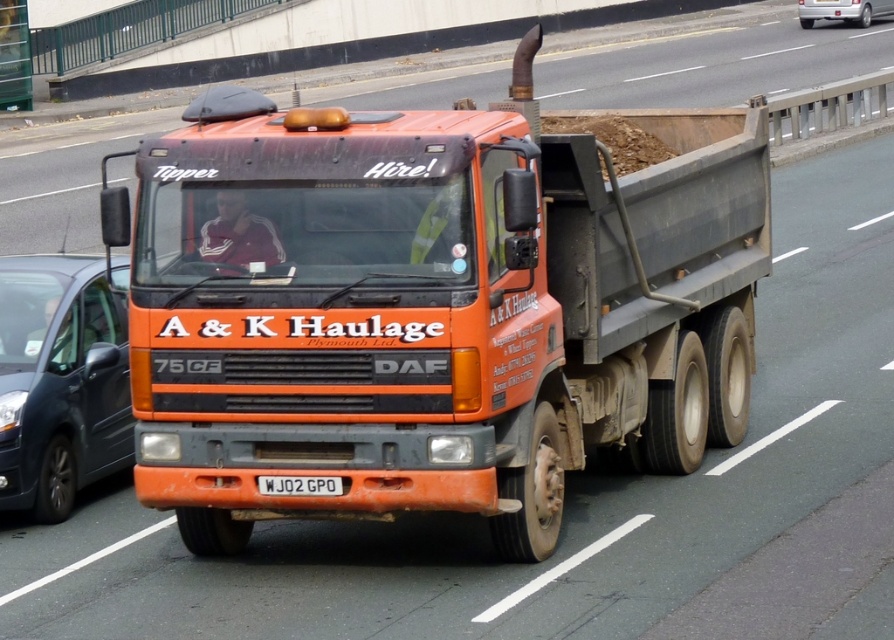
You are a traffic officer observing the road. You see an orange matte truck at center and a silver metallic sedan at upper right. Which vehicle is positioned lower in the image?

The orange matte truck at center is located below the silver metallic sedan at upper right, so the orange matte truck at center is positioned lower in the image.

You are standing on the sidewalk next to the road where the large orange DAF 75CF tipper truck is driving. You want to take a photo of the truck and the matte black van at left. Where should you position yourself to capture both vehicles in the frame?

You should position yourself at point (60, 380) to capture both the large orange DAF 75CF tipper truck and the matte black van at left in the frame.